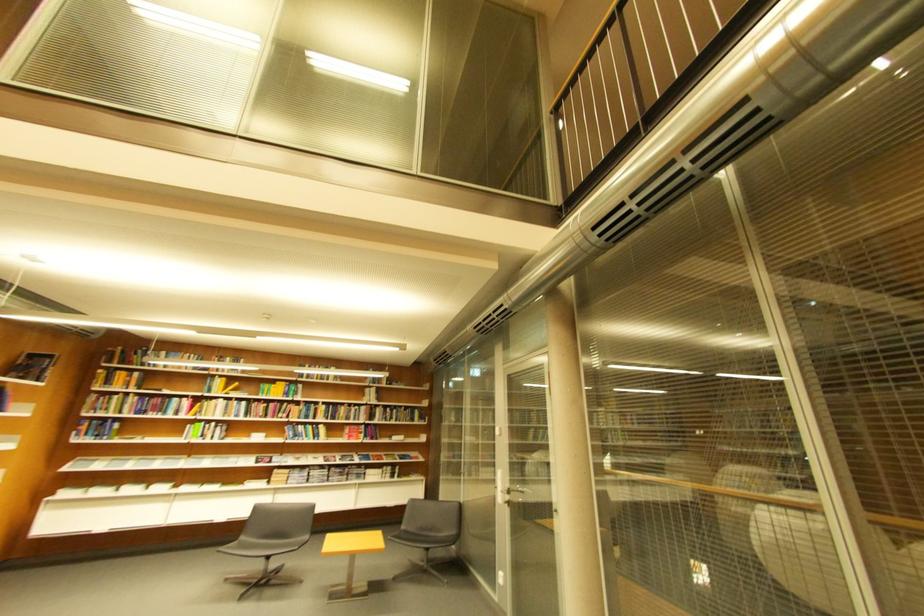
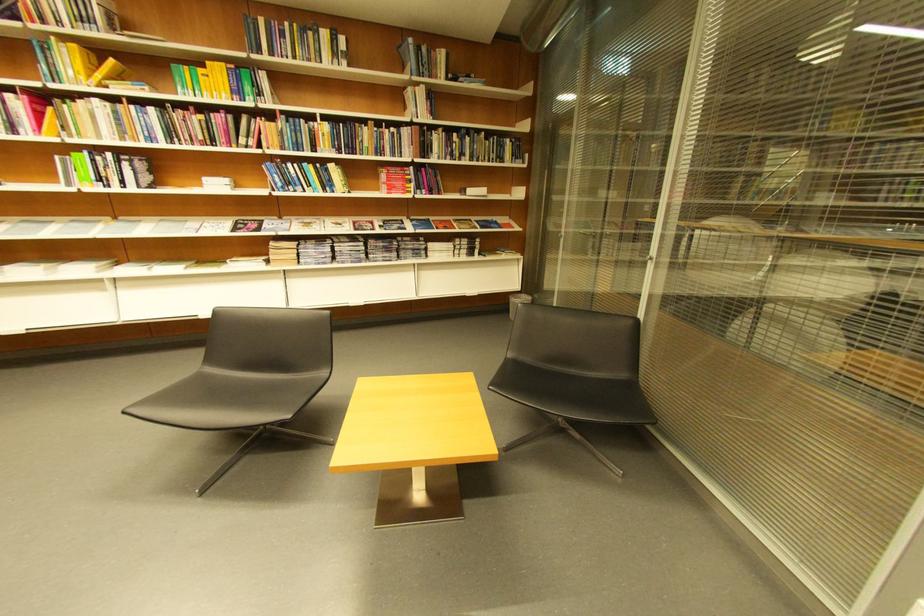
In the second image, find the point that corresponds to the point at 388,386 in the first image.

(441, 78)